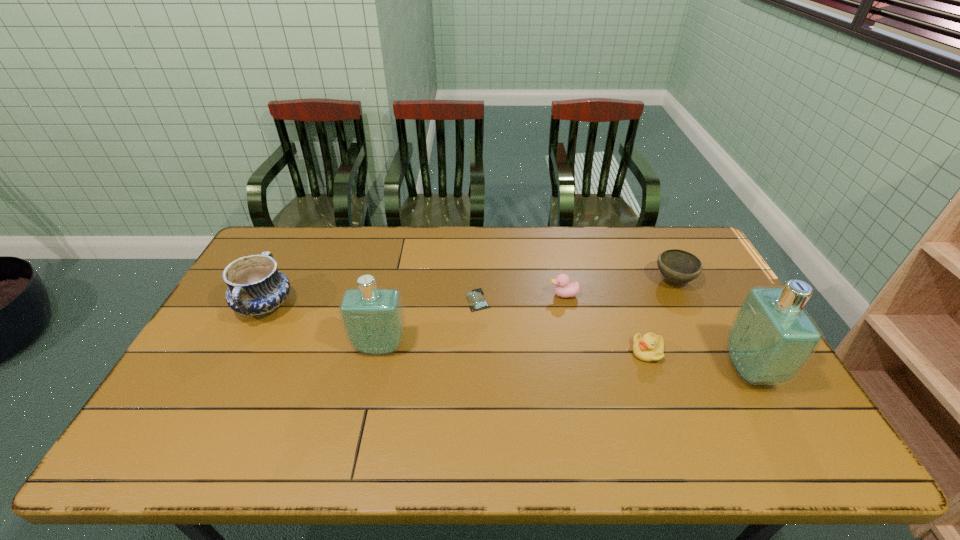
The width and height of the screenshot is (960, 540). Find the location of `vacant point located between the bowl and the fourth object from right to left`. vacant point located between the bowl and the fourth object from right to left is located at coordinates (619, 288).

Where is `empty location between the bowl and the right duckling`? Image resolution: width=960 pixels, height=540 pixels. empty location between the bowl and the right duckling is located at coordinates (660, 316).

At what (x,y) coordinates should I click in order to perform the action: click on free area in between the tallest object and the bowl. Please return your answer as a coordinate pair (x, y). This screenshot has height=540, width=960. Looking at the image, I should click on (711, 325).

The image size is (960, 540). I want to click on vacant space that is in between the fifth shortest object and the right perfume, so click(507, 338).

Identify which object is located as the sixth nearest to the left duckling. Please provide its 2D coordinates. Your answer should be formatted as a tuple, i.e. [(x, y)], where the tuple contains the x and y coordinates of a point satisfying the conditions above.

[(256, 288)]

Locate which object is the closest to the left duckling. Please provide its 2D coordinates. Your answer should be formatted as a tuple, i.e. [(x, y)], where the tuple contains the x and y coordinates of a point satisfying the conditions above.

[(475, 298)]

Find the location of a particular element. The width and height of the screenshot is (960, 540). free spot that satisfies the following two spatial constraints: 1. on the front-facing side of the left duckling; 2. on the front side of the leftmost object is located at coordinates (566, 306).

You are a GUI agent. You are given a task and a screenshot of the screen. Output one action in this format:
    pyautogui.click(x=<x>, y=<y>)
    Task: Click on the free point that satisfies the following two spatial constraints: 1. on the back side of the third tallest object; 2. on the right side of the bowl
    The image size is (960, 540).
    Given the screenshot: What is the action you would take?
    pyautogui.click(x=278, y=280)